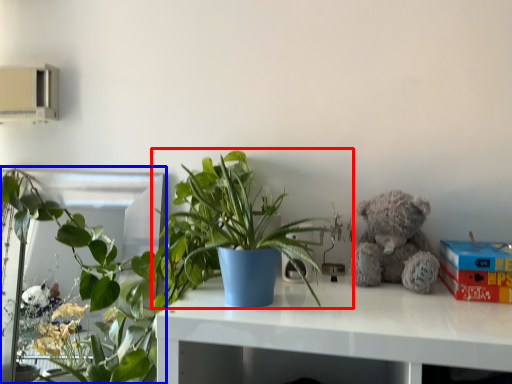
Question: Which object appears farthest to the camera in this image, houseplant (highlighted by a red box) or houseplant (highlighted by a blue box)?

Choices:
 (A) houseplant
 (B) houseplant

Answer: (B)